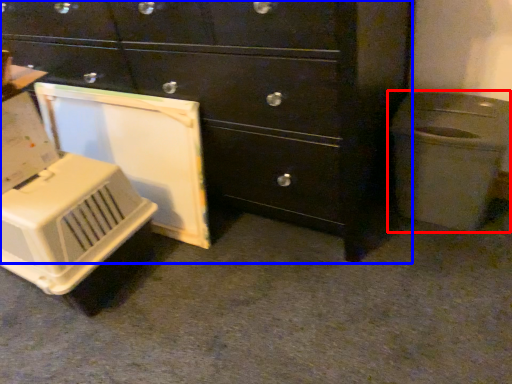
Question: Which object is closer to the camera taking this photo, waste container (highlighted by a red box) or chest of drawers (highlighted by a blue box)?

Choices:
 (A) waste container
 (B) chest of drawers

Answer: (B)